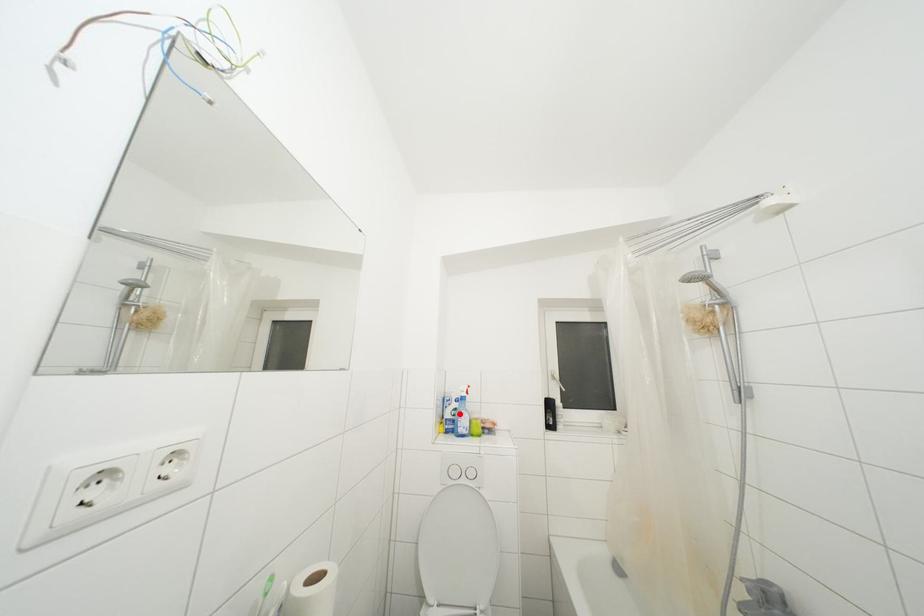
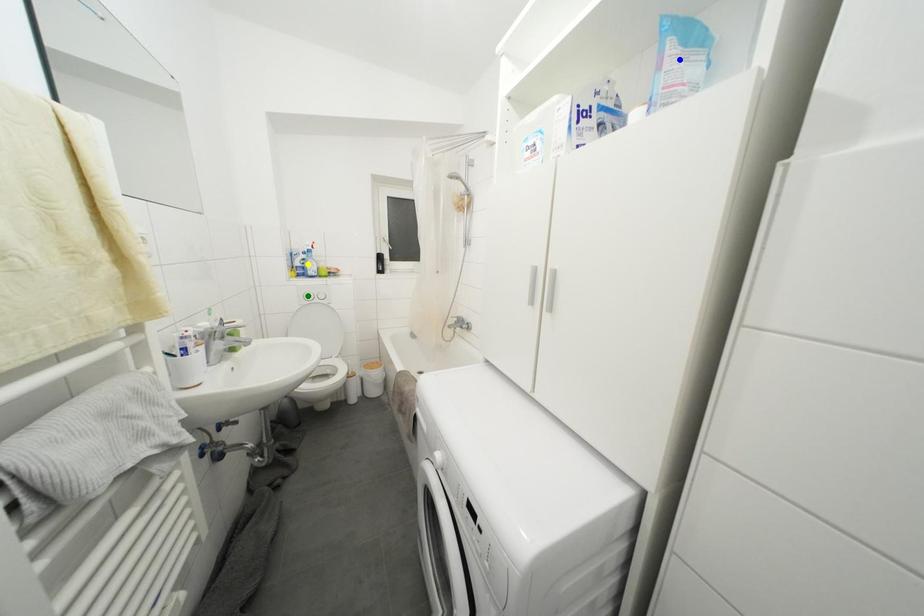
Question: I am providing you with two images of the same scene from different viewpoints. A red point is marked on the first image. You are given multiple points on the second image. Which point in image 2 represents the same 3d spot as the red point in image 1?

Choices:
 (A) green point
 (B) blue point
 (C) yellow point

Answer: (C)